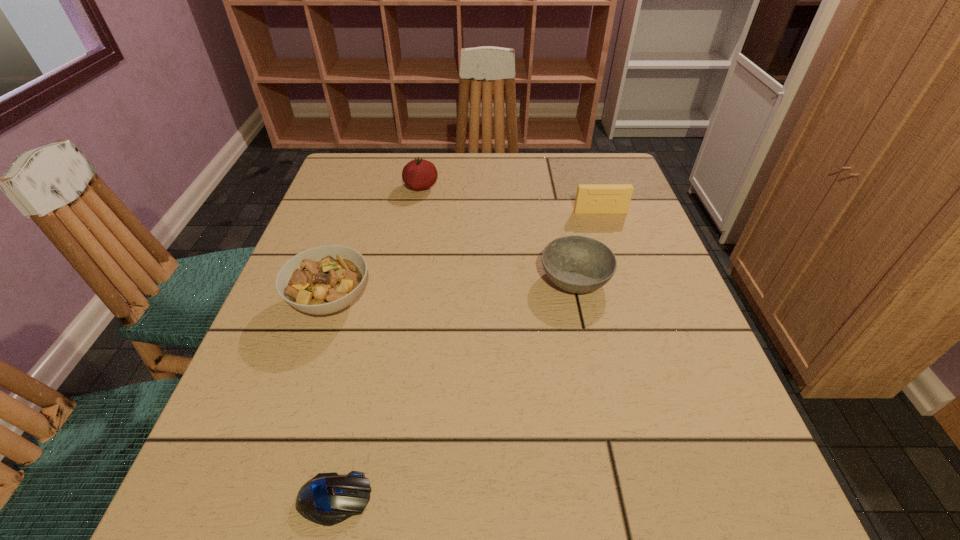
Identify the location of the farthest object. This screenshot has width=960, height=540. (419, 174).

This screenshot has height=540, width=960. I want to click on the fourth nearest object, so click(591, 198).

Identify the location of stew. The height and width of the screenshot is (540, 960). (325, 279).

Locate an element on the screen. The image size is (960, 540). the fourth tallest object is located at coordinates (577, 264).

Locate an element on the screen. the shortest object is located at coordinates (327, 499).

This screenshot has height=540, width=960. I want to click on the nearest object, so click(327, 499).

The height and width of the screenshot is (540, 960). I want to click on free region located 0.290m on the right of the farthest object, so click(547, 187).

The height and width of the screenshot is (540, 960). What are the coordinates of `vacant position located at the front of the videotape with spools` in the screenshot? It's located at point(626,291).

I want to click on vacant space located 0.100m on the back of the stew, so (350, 241).

You are a GUI agent. You are given a task and a screenshot of the screen. Output one action in this format:
    pyautogui.click(x=<x>, y=<y>)
    Task: Click on the vacant space positioned 0.300m on the left of the bowl
    The width and height of the screenshot is (960, 540).
    Given the screenshot: What is the action you would take?
    tap(396, 279)